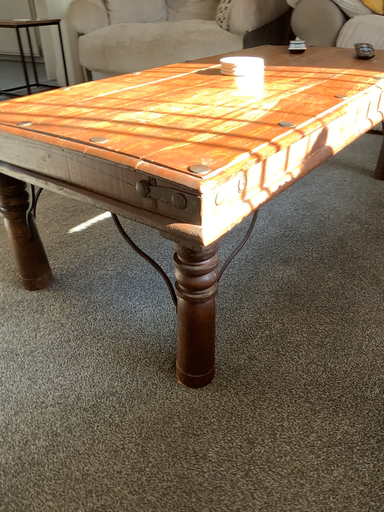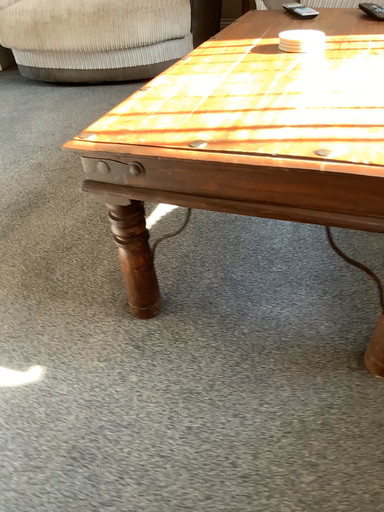
Question: Which way did the camera rotate in the video?

Choices:
 (A) rotated left
 (B) rotated right

Answer: (B)